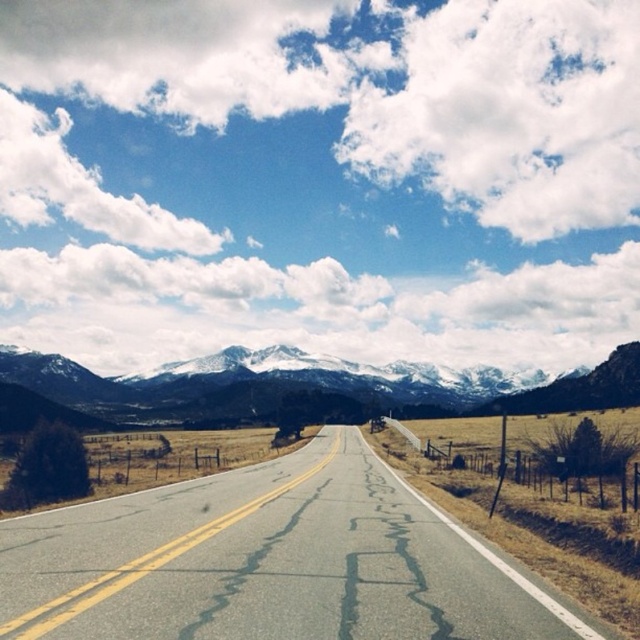
Question: Is asphalt road at center to the right of snowy granite mountains at center from the viewer's perspective?

Choices:
 (A) no
 (B) yes

Answer: (B)

Question: Is asphalt road at center smaller than snowy granite mountains at center?

Choices:
 (A) no
 (B) yes

Answer: (B)

Question: Which point is farther to the camera?

Choices:
 (A) (342, 566)
 (B) (211, 413)

Answer: (B)

Question: Among these points, which one is nearest to the camera?

Choices:
 (A) (291, 349)
 (B) (349, 595)

Answer: (B)

Question: Among these points, which one is nearest to the camera?

Choices:
 (A) (628, 342)
 (B) (131, 518)

Answer: (B)

Question: Does asphalt road at center appear over snowy granite mountains at center?

Choices:
 (A) no
 (B) yes

Answer: (B)